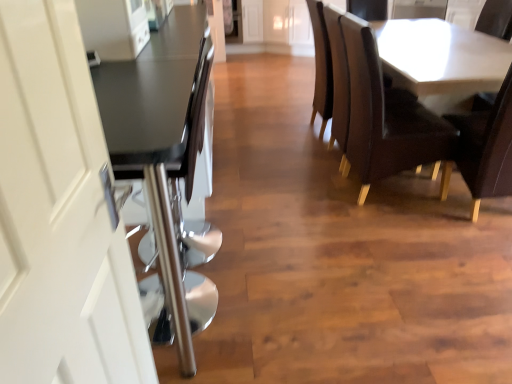
Locate an element on the screen. Image resolution: width=512 pixels, height=384 pixels. vacant space positioned to the left of dark brown leather chair at right, the second chair in the left-to-right sequence is located at coordinates (419, 225).